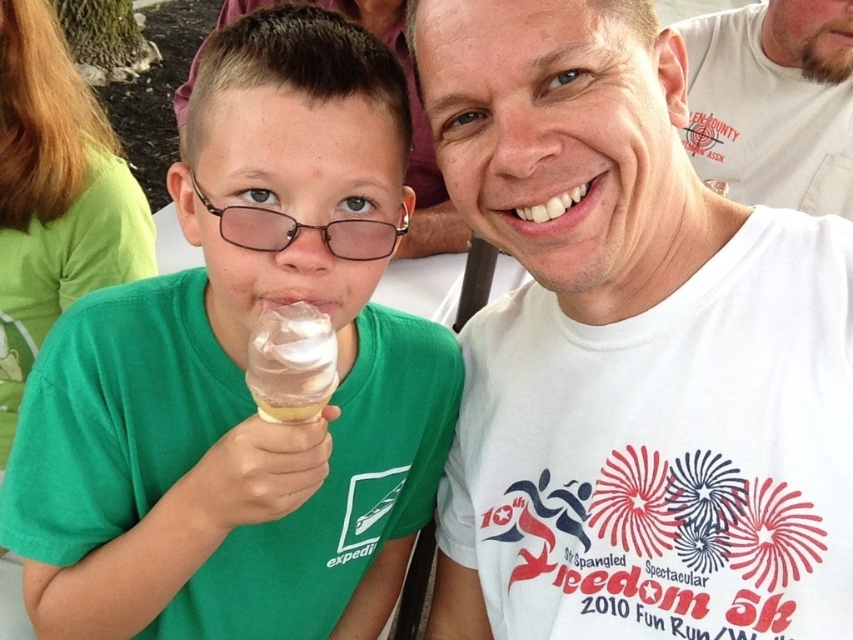
You are standing at the point with coordinates point (297, 353) and want to move to the point with coordinates point (814, 394). Which direction should you move in to reach your destination?

To reach point (814, 394) from point (297, 353), you should move upwards and to the right because point (814, 394) is behind point (297, 353).